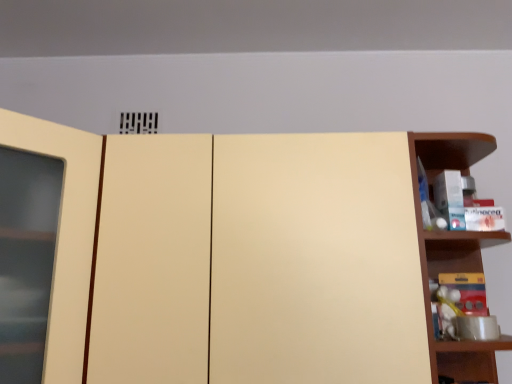
Question: Considering the relative positions of matte cream cupboard at center and matte yellow toy at right in the image provided, is matte cream cupboard at center to the right of matte yellow toy at right from the viewer's perspective?

Choices:
 (A) yes
 (B) no

Answer: (B)

Question: Is matte yellow toy at right surrounded by matte cream cupboard at center?

Choices:
 (A) no
 (B) yes

Answer: (A)

Question: Considering the relative sizes of matte cream cupboard at center and matte yellow toy at right in the image provided, is matte cream cupboard at center bigger than matte yellow toy at right?

Choices:
 (A) no
 (B) yes

Answer: (B)

Question: From a real-world perspective, is matte cream cupboard at center beneath matte yellow toy at right?

Choices:
 (A) no
 (B) yes

Answer: (A)

Question: From the image's perspective, is matte cream cupboard at center above matte yellow toy at right?

Choices:
 (A) no
 (B) yes

Answer: (B)

Question: From the image's perspective, is wooden shelf at right above or below matte yellow toy at right?

Choices:
 (A) above
 (B) below

Answer: (A)

Question: Does point (431, 370) appear closer or farther from the camera than point (449, 327)?

Choices:
 (A) closer
 (B) farther

Answer: (A)

Question: Is wooden shelf at right inside or outside of matte yellow toy at right?

Choices:
 (A) inside
 (B) outside

Answer: (B)

Question: From a real-world perspective, is wooden shelf at right physically located above or below matte yellow toy at right?

Choices:
 (A) below
 (B) above

Answer: (B)

Question: Is wooden shelf at right taller or shorter than matte cream cupboard at center?

Choices:
 (A) short
 (B) tall

Answer: (A)

Question: Considering the positions of wooden shelf at right and matte cream cupboard at center in the image, is wooden shelf at right bigger or smaller than matte cream cupboard at center?

Choices:
 (A) big
 (B) small

Answer: (B)

Question: Considering the positions of point (426, 236) and point (88, 196), is point (426, 236) closer or farther from the camera than point (88, 196)?

Choices:
 (A) closer
 (B) farther

Answer: (B)

Question: In the image, is wooden shelf at right positioned in front of or behind matte cream cupboard at center?

Choices:
 (A) behind
 (B) front

Answer: (A)

Question: Is matte cream cupboard at center in front of or behind matte yellow toy at right in the image?

Choices:
 (A) behind
 (B) front

Answer: (B)

Question: Choose the correct answer: Is matte cream cupboard at center inside matte yellow toy at right or outside it?

Choices:
 (A) inside
 (B) outside

Answer: (B)